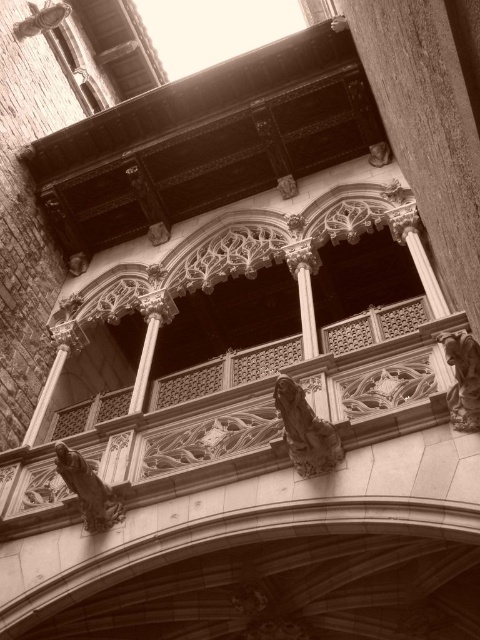
You are an architect inspecting the building from the ground floor. You notice the polished stone statue at right and the smooth stone column at center. Which object would require a taller ladder to reach its top? Please explain your reasoning based on their sizes.

The smooth stone column at center is larger than the polished stone statue at right. Therefore, a taller ladder would be needed to reach the top of the smooth stone column at center.

You are an architect examining the structure of the building. You notice the dark stone gargoyle at lower left and the smooth stone column at center. Which of these two elements is shorter in height?

The dark stone gargoyle at lower left has a lesser height compared to the smooth stone column at center, so the dark stone gargoyle at lower left is shorter in height.

You are standing at the base of this historical building and want to place a 100 feet long banner between the dark stone gargoyle at lower left and the smooth stone column at center. Will the banner be long enough to stretch between them?

The dark stone gargoyle at lower left is 74.11 feet away from the smooth stone column at center, so the 100 feet long banner will be long enough to stretch between them.